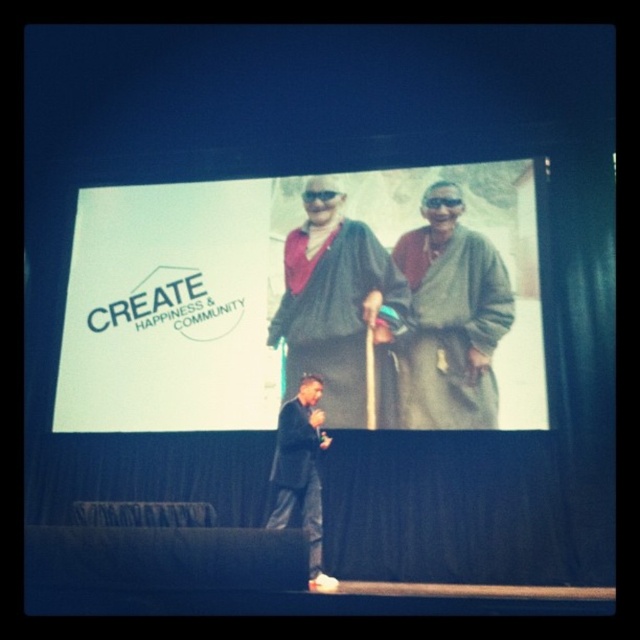
You are an event organizer who needs to place a small podium at point (305, 301). Is there enough space between the white paper at upper center and the presenter to place it there?

The white paper at upper center is located at point (305, 301), so placing a small podium there would interfere with the white paper at upper center since they are at the same location.

You are an event organizer who needs to adjust the projector to ensure the white paper at upper center and the dark green textured robe at center are both clearly visible. Which object should you focus on first to adjust the projector height?

The white paper at upper center is taller than the dark green textured robe at center, so you should focus on adjusting the projector height to accommodate the taller white paper at upper center first.